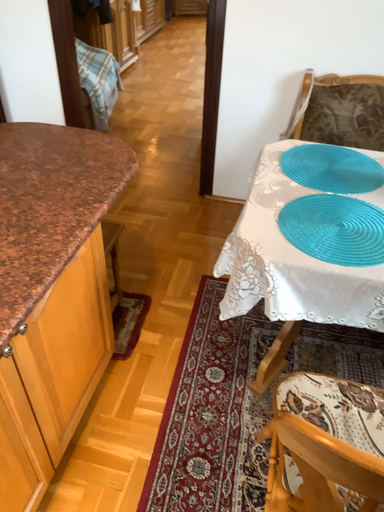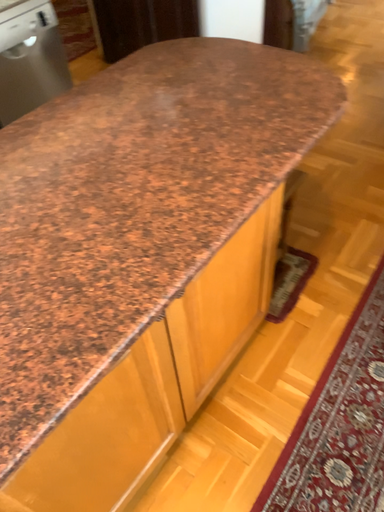
Question: Which way did the camera rotate in the video?

Choices:
 (A) rotated downward
 (B) rotated upward

Answer: (A)